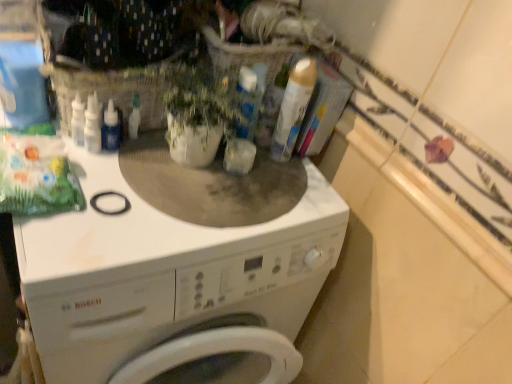
Question: Is white matte washing machine at center bigger or smaller than white glossy counter top at upper right?

Choices:
 (A) big
 (B) small

Answer: (A)

Question: Considering the positions of white matte washing machine at center and white glossy counter top at upper right in the image, is white matte washing machine at center wider or thinner than white glossy counter top at upper right?

Choices:
 (A) wide
 (B) thin

Answer: (A)

Question: Which object is the closest to the gold metallic can at upper center?

Choices:
 (A) white matte washing machine at center
 (B) white glossy counter top at upper right
 (C) transparent plastic bottle at center
 (D) green matte plant at center

Answer: (D)

Question: Which of these objects is positioned closest to the transparent plastic bottle at center?

Choices:
 (A) green matte plant at center
 (B) gold metallic can at upper center
 (C) white glossy counter top at upper right
 (D) white matte washing machine at center

Answer: (A)